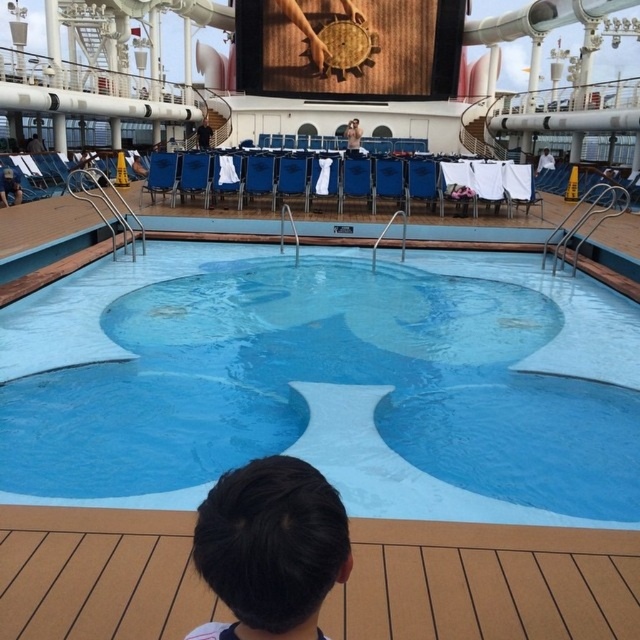
Question: Which point is closer to the camera?

Choices:
 (A) brown wood deck at lower center
 (B) blue fabric chair at center
 (C) blue smooth pool at center
 (D) dark brown hair at lower center

Answer: (D)

Question: Does dark brown hair at lower center appear on the left side of blue fabric chair at center?

Choices:
 (A) no
 (B) yes

Answer: (A)

Question: Which object appears closest to the camera in this image?

Choices:
 (A) dark brown hair at lower center
 (B) blue fabric chair at center

Answer: (A)

Question: Does dark brown hair at lower center have a larger size compared to blue fabric chair at center?

Choices:
 (A) no
 (B) yes

Answer: (A)

Question: Does brown wood deck at lower center have a lesser width compared to blue fabric chair at center?

Choices:
 (A) yes
 (B) no

Answer: (B)

Question: Among these objects, which one is farthest from the camera?

Choices:
 (A) dark brown hair at lower center
 (B) blue fabric chair at center
 (C) blue smooth pool at center
 (D) brown wood deck at lower center

Answer: (B)